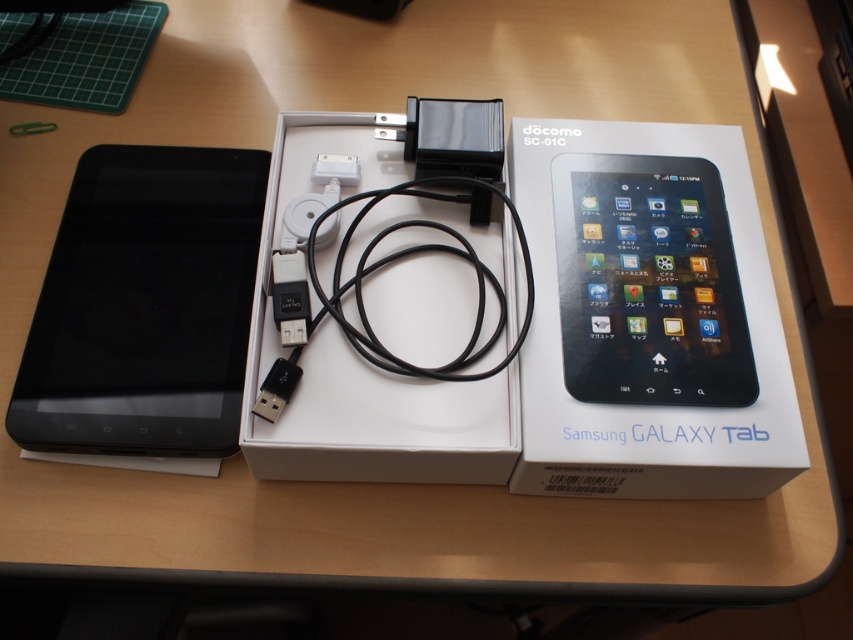
You are a delivery person who needs to place a package on the desk. The package must be placed exactly at the point marked by the coordinates point (645,317). What object is located at that point?

The point (645,317) corresponds to the white matte samsung galaxy tab box at center.

You are a customer looking to set up your new Samsung Galaxy Tab. You notice a point at coordinates (x=648, y=282) on the desk. Based on the scene description, what object is located at that point?

The point at coordinates (x=648, y=282) indicates the location of the black glossy tablet at upper center.